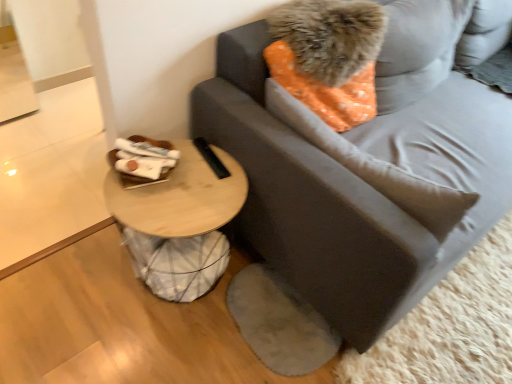
Locate an element on the screen. free point above woodenmaterial/texturetable at lower left (from a real-world perspective) is located at coordinates (180, 188).